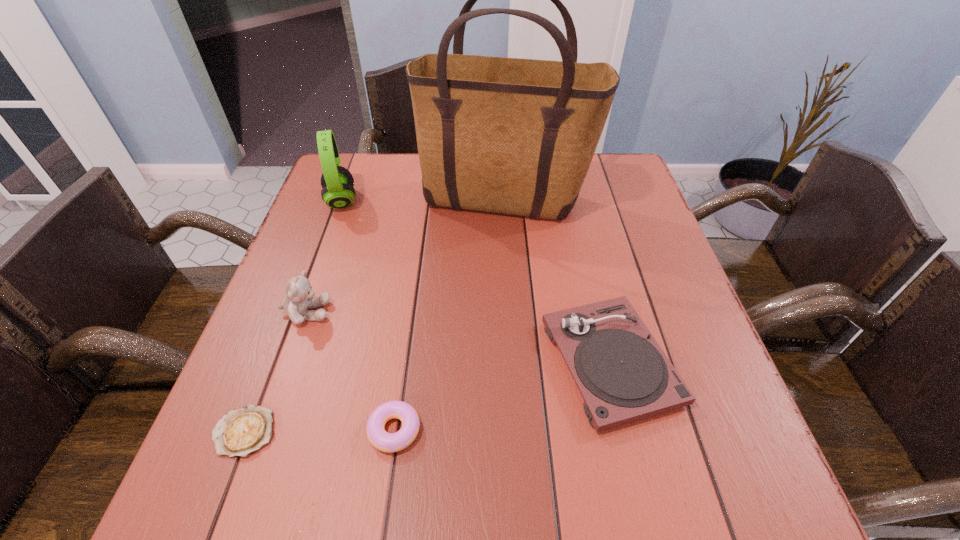
Locate an element on the screen. free spot between the second tallest object and the fourth shortest object is located at coordinates (324, 256).

The image size is (960, 540). Find the location of `vacant area that lies between the quiche and the phonograph_record`. vacant area that lies between the quiche and the phonograph_record is located at coordinates (427, 397).

You are a GUI agent. You are given a task and a screenshot of the screen. Output one action in this format:
    pyautogui.click(x=<x>, y=<y>)
    Task: Click on the vacant area between the quiche and the third tallest object
    
    Given the screenshot: What is the action you would take?
    pyautogui.click(x=275, y=372)

You are a GUI agent. You are given a task and a screenshot of the screen. Output one action in this format:
    pyautogui.click(x=<x>, y=<y>)
    Task: Click on the object that is the closest to the fifth shortest object
    
    Given the screenshot: What is the action you would take?
    pyautogui.click(x=515, y=136)

What are the coordinates of `the third closest object to the fifth tallest object` in the screenshot? It's located at (623, 375).

Locate an element on the screen. Image resolution: width=960 pixels, height=540 pixels. free spot that satisfies the following two spatial constraints: 1. on the back side of the shortest object; 2. on the right side of the fifth shortest object is located at coordinates (333, 201).

Where is `free point that satisfies the following two spatial constraints: 1. on the front side of the phonograph_record; 2. on the right side of the second tallest object`? The image size is (960, 540). free point that satisfies the following two spatial constraints: 1. on the front side of the phonograph_record; 2. on the right side of the second tallest object is located at coordinates (282, 362).

Find the location of a particular element. The width and height of the screenshot is (960, 540). blank area in the image that satisfies the following two spatial constraints: 1. on the face of the fifth tallest object; 2. on the right side of the fourth shortest object is located at coordinates (264, 430).